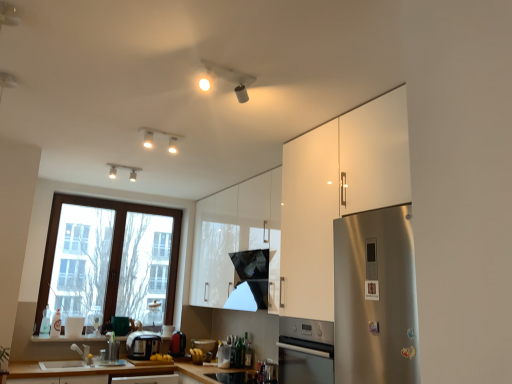
Question: From a real-world perspective, is translucent plastic bottle at window, the 3th bottle from the right, over satin silver toaster at center, which ranks as the 1th appliance in left-to-right order?

Choices:
 (A) no
 (B) yes

Answer: (B)

Question: Is translucent plastic bottle at window, the 3th bottle from the right, positioned in front of satin silver toaster at center, which ranks as the 1th appliance in left-to-right order?

Choices:
 (A) yes
 (B) no

Answer: (B)

Question: Is translucent plastic bottle at window, which appears as the second bottle when viewed from the left, behind satin silver toaster at center, the third appliance from the right?

Choices:
 (A) no
 (B) yes

Answer: (B)

Question: Does translucent plastic bottle at window, the 3th bottle from the right, have a greater height compared to satin silver toaster at center, which ranks as the 1th appliance in left-to-right order?

Choices:
 (A) no
 (B) yes

Answer: (B)

Question: Is translucent plastic bottle at window, the 3th bottle from the right, far away from satin silver toaster at center, which ranks as the 1th appliance in left-to-right order?

Choices:
 (A) no
 (B) yes

Answer: (A)

Question: Is point (391, 125) positioned closer to the camera than point (81, 352)?

Choices:
 (A) closer
 (B) farther

Answer: (A)

Question: Is white glossy cabinet at right, the first cabinetry when ordered from front to back, to the left or to the right of matte silver faucet at lower left in the image?

Choices:
 (A) left
 (B) right

Answer: (B)

Question: From a real-world perspective, is white glossy cabinet at right, marked as the 2th cabinetry in a back-to-front arrangement, positioned above or below matte silver faucet at lower left?

Choices:
 (A) below
 (B) above

Answer: (B)

Question: Considering the positions of white glossy cabinet at right, the first cabinetry when ordered from front to back, and matte silver faucet at lower left in the image, is white glossy cabinet at right, the first cabinetry when ordered from front to back, bigger or smaller than matte silver faucet at lower left?

Choices:
 (A) big
 (B) small

Answer: (A)

Question: Would you say satin silver toaster at center, which ranks as the 1th appliance in left-to-right order, is inside or outside glossy black exhaust hood at center?

Choices:
 (A) inside
 (B) outside

Answer: (B)

Question: In terms of size, does satin silver toaster at center, which ranks as the 1th appliance in left-to-right order, appear bigger or smaller than glossy black exhaust hood at center?

Choices:
 (A) big
 (B) small

Answer: (B)

Question: From their relative heights in the image, would you say satin silver toaster at center, the third appliance from the right, is taller or shorter than glossy black exhaust hood at center?

Choices:
 (A) short
 (B) tall

Answer: (A)

Question: Relative to glossy black exhaust hood at center, is satin silver toaster at center, the third appliance from the right, in front or behind?

Choices:
 (A) front
 (B) behind

Answer: (B)

Question: In the image, is translucent glass bottle at lower left, the first bottle from the left, positioned in front of or behind glossy black exhaust hood at center?

Choices:
 (A) front
 (B) behind

Answer: (B)

Question: In terms of width, does translucent glass bottle at lower left, the first bottle from the left, look wider or thinner when compared to glossy black exhaust hood at center?

Choices:
 (A) thin
 (B) wide

Answer: (A)